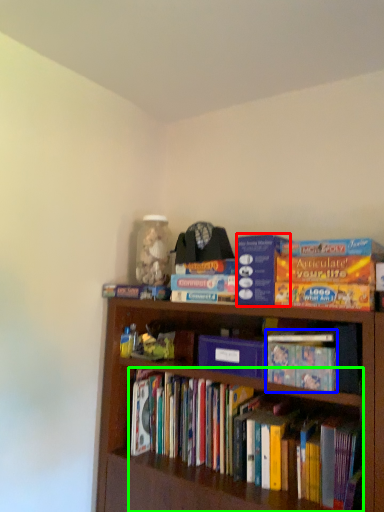
Question: Which object is positioned closest to paperback book (highlighted by a red box)? Select from book (highlighted by a blue box) and book (highlighted by a green box).

Choices:
 (A) book
 (B) book

Answer: (A)